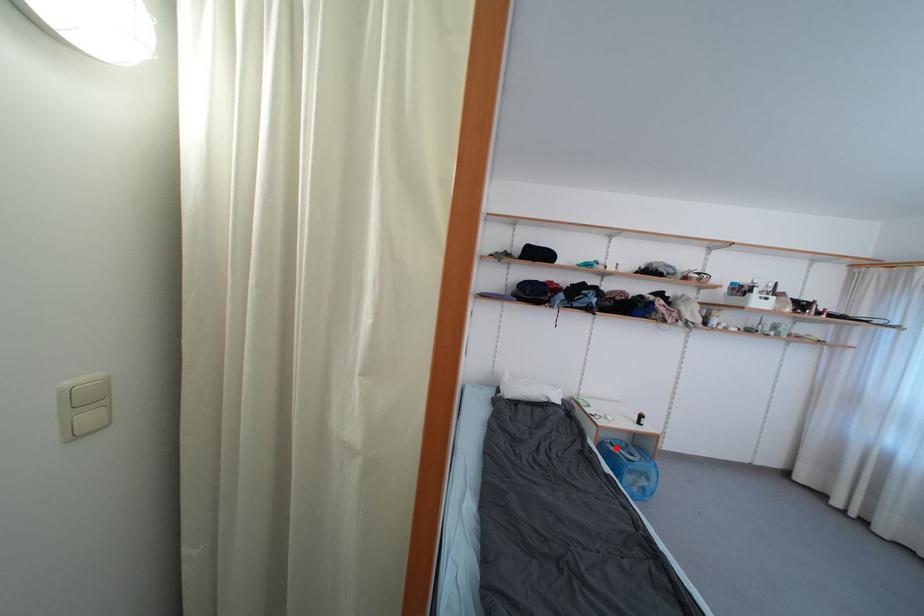
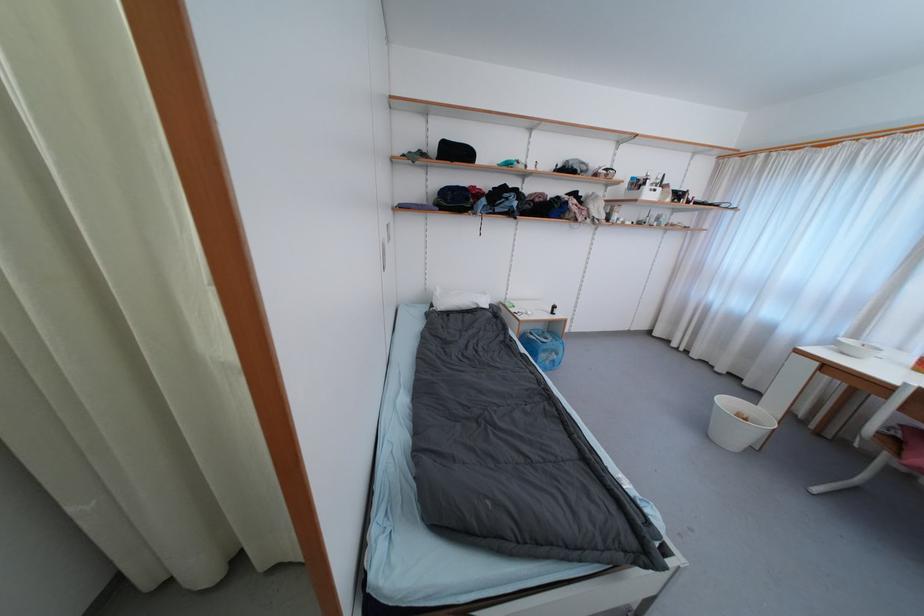
In the second image, find the point that corresponds to the highlighted location in the first image.

(535, 336)